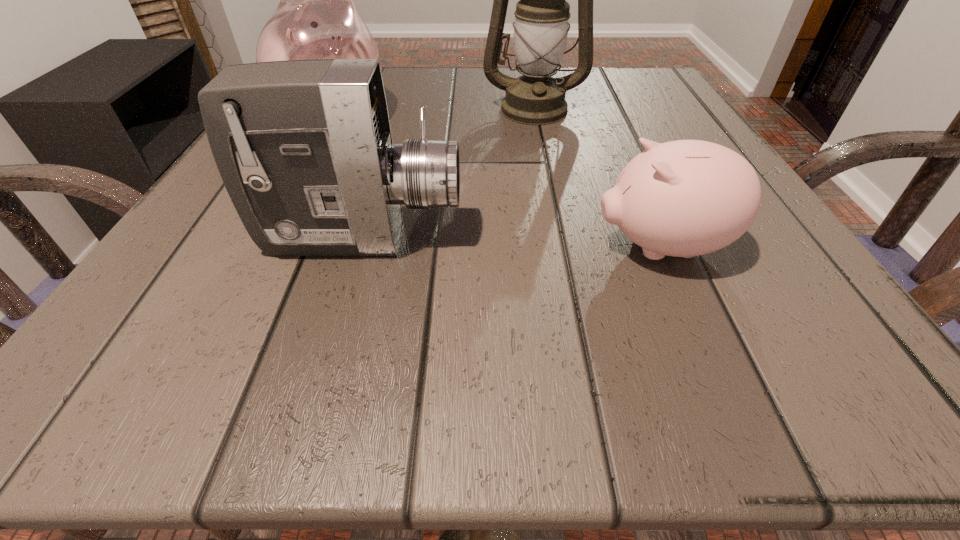
You are a GUI agent. You are given a task and a screenshot of the screen. Output one action in this format:
    pyautogui.click(x=<x>, y=<y>)
    Task: Click on the vacant space located 0.120m at the snout of the right piggy bank
    The image size is (960, 540).
    Given the screenshot: What is the action you would take?
    pyautogui.click(x=496, y=247)

Identify the location of oil lamp positioned at the far edge. The height and width of the screenshot is (540, 960). (541, 29).

Identify the location of piggy bank present at the far edge. (316, 18).

What are the coordinates of `camcorder present at the left edge` in the screenshot? It's located at (304, 148).

Locate an element on the screen. Image resolution: width=960 pixels, height=540 pixels. piggy bank situated at the left edge is located at coordinates (316, 18).

You are a GUI agent. You are given a task and a screenshot of the screen. Output one action in this format:
    pyautogui.click(x=<x>, y=<y>)
    Task: Click on the object at the right edge
    
    Given the screenshot: What is the action you would take?
    pyautogui.click(x=684, y=198)

You are a GUI agent. You are given a task and a screenshot of the screen. Output one action in this format:
    pyautogui.click(x=<x>, y=<y>)
    Task: Click on the object present at the far left corner
    This screenshot has height=540, width=960.
    Given the screenshot: What is the action you would take?
    pyautogui.click(x=316, y=18)

Identify the location of free space at the far edge of the desktop. The width and height of the screenshot is (960, 540). (489, 102).

Identify the location of free space at the near edge of the desktop. (492, 348).

This screenshot has height=540, width=960. In the image, there is a desktop. What are the coordinates of `vacant space at the right edge` in the screenshot? It's located at (756, 220).